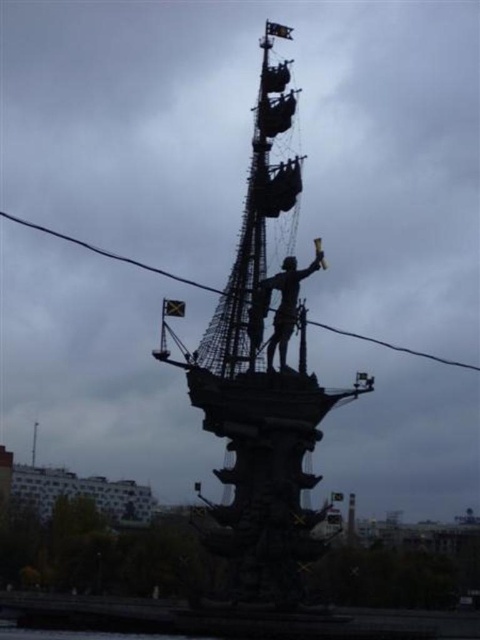
Who is more forward, (x=290, y=513) or (x=432, y=358)?

Point (x=290, y=513) is more forward.

Who is more forward, (228, 321) or (415, 355)?

Point (228, 321) is in front.

Where is `black matte ship at center`? The image size is (480, 640). black matte ship at center is located at coordinates (262, 378).

Is silhouette bronze statue at center closer to camera compared to black wire at center?

Yes, it is.

Is silhouette bronze statue at center smaller than black wire at center?

Yes.

Which is in front, point (282, 312) or point (439, 362)?

Point (282, 312) is in front.

This screenshot has height=640, width=480. Identify the location of silhouette bronze statue at center. [x=279, y=305].

Does point (255, 472) come closer to viewer compared to point (254, 316)?

That is True.

In the scene shown: Does black matte ship at center have a larger size compared to silhouette bronze statue at center?

Indeed, black matte ship at center has a larger size compared to silhouette bronze statue at center.

The width and height of the screenshot is (480, 640). Identify the location of black matte ship at center. (262, 378).

Where is `black matte ship at center`? black matte ship at center is located at coordinates (262, 378).